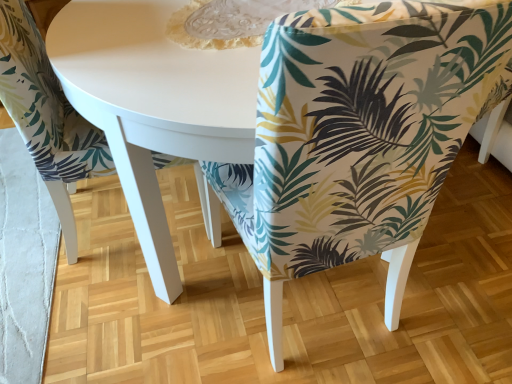
Describe the element at coordinates (362, 134) in the screenshot. This screenshot has height=384, width=512. I see `printed fabric chair at center, marked as the second chair in a left-to-right arrangement` at that location.

What is the approximate height of printed fabric chair at center, the 1th chair viewed from the right?

printed fabric chair at center, the 1th chair viewed from the right, is 38.58 inches tall.

Locate an element on the screen. The height and width of the screenshot is (384, 512). printed fabric chair at center, the 1th chair viewed from the right is located at coordinates (362, 134).

In order to click on printed fabric chair at center, which is counted as the 1th chair, starting from the left in this screenshot , I will do `click(47, 116)`.

This screenshot has width=512, height=384. Describe the element at coordinates (47, 116) in the screenshot. I see `printed fabric chair at center, the second chair positioned from the right` at that location.

Where is `printed fabric chair at center, marked as the second chair in a left-to-right arrangement`? printed fabric chair at center, marked as the second chair in a left-to-right arrangement is located at coordinates (362, 134).

Is printed fabric chair at center, the 1th chair viewed from the right, at the right side of printed fabric chair at center, which is counted as the 1th chair, starting from the left?

Correct, you'll find printed fabric chair at center, the 1th chair viewed from the right, to the right of printed fabric chair at center, which is counted as the 1th chair, starting from the left.

Based on the photo, is printed fabric chair at center, marked as the second chair in a left-to-right arrangement, in front of or behind printed fabric chair at center, which is counted as the 1th chair, starting from the left, in the image?

printed fabric chair at center, marked as the second chair in a left-to-right arrangement, is in front of printed fabric chair at center, which is counted as the 1th chair, starting from the left.

Is point (343, 171) behind point (73, 168)?

No, it is not.

From the image's perspective, is printed fabric chair at center, marked as the second chair in a left-to-right arrangement, on top of printed fabric chair at center, which is counted as the 1th chair, starting from the left?

No, from the image's perspective, printed fabric chair at center, marked as the second chair in a left-to-right arrangement, is not above printed fabric chair at center, which is counted as the 1th chair, starting from the left.

From a real-world perspective, is printed fabric chair at center, the 1th chair viewed from the right, located higher than printed fabric chair at center, the second chair positioned from the right?

Yes.

Which object is wider, printed fabric chair at center, the 1th chair viewed from the right, or printed fabric chair at center, which is counted as the 1th chair, starting from the left?

Wider between the two is printed fabric chair at center, which is counted as the 1th chair, starting from the left.

Which of these two, printed fabric chair at center, marked as the second chair in a left-to-right arrangement, or printed fabric chair at center, the second chair positioned from the right, stands taller?

printed fabric chair at center, marked as the second chair in a left-to-right arrangement, is taller.

Between printed fabric chair at center, the 1th chair viewed from the right, and printed fabric chair at center, the second chair positioned from the right, which one has smaller size?

With smaller size is printed fabric chair at center, the second chair positioned from the right.

Is printed fabric chair at center, the 1th chair viewed from the right, spatially inside printed fabric chair at center, which is counted as the 1th chair, starting from the left, or outside of it?

printed fabric chair at center, the 1th chair viewed from the right, is spatially situated outside printed fabric chair at center, which is counted as the 1th chair, starting from the left.

Is printed fabric chair at center, marked as the second chair in a left-to-right arrangement, far from printed fabric chair at center, the second chair positioned from the right?

printed fabric chair at center, marked as the second chair in a left-to-right arrangement, is near printed fabric chair at center, the second chair positioned from the right, not far away.

Is printed fabric chair at center, the second chair positioned from the right, at the back of printed fabric chair at center, marked as the second chair in a left-to-right arrangement?

No, printed fabric chair at center, marked as the second chair in a left-to-right arrangement,'s orientation is not away from printed fabric chair at center, the second chair positioned from the right.

What's the angular difference between printed fabric chair at center, the 1th chair viewed from the right, and printed fabric chair at center, the second chair positioned from the right,'s facing directions?

The facing directions of printed fabric chair at center, the 1th chair viewed from the right, and printed fabric chair at center, the second chair positioned from the right, are 89 degrees apart.

Identify the location of chair located on the left of printed fabric chair at center, marked as the second chair in a left-to-right arrangement. The height and width of the screenshot is (384, 512). (47, 116).

Which is more to the right, printed fabric chair at center, the second chair positioned from the right, or printed fabric chair at center, the 1th chair viewed from the right?

From the viewer's perspective, printed fabric chair at center, the 1th chair viewed from the right, appears more on the right side.

Between printed fabric chair at center, which is counted as the 1th chair, starting from the left, and printed fabric chair at center, the 1th chair viewed from the right, which one is positioned in front?

Positioned in front is printed fabric chair at center, the 1th chair viewed from the right.

Which is behind, point (83, 164) or point (455, 122)?

The point (83, 164) is farther.

From the image's perspective, would you say printed fabric chair at center, which is counted as the 1th chair, starting from the left, is shown under printed fabric chair at center, marked as the second chair in a left-to-right arrangement?

No, from the image's perspective, printed fabric chair at center, which is counted as the 1th chair, starting from the left, is not below printed fabric chair at center, marked as the second chair in a left-to-right arrangement.

From a real-world perspective, is printed fabric chair at center, which is counted as the 1th chair, starting from the left, below printed fabric chair at center, marked as the second chair in a left-to-right arrangement?

Yes, from a real-world perspective, printed fabric chair at center, which is counted as the 1th chair, starting from the left, is below printed fabric chair at center, marked as the second chair in a left-to-right arrangement.

Looking at their sizes, would you say printed fabric chair at center, which is counted as the 1th chair, starting from the left, is wider or thinner than printed fabric chair at center, marked as the second chair in a left-to-right arrangement?

In the image, printed fabric chair at center, which is counted as the 1th chair, starting from the left, appears to be wider than printed fabric chair at center, marked as the second chair in a left-to-right arrangement.

Considering the relative sizes of printed fabric chair at center, which is counted as the 1th chair, starting from the left, and printed fabric chair at center, marked as the second chair in a left-to-right arrangement, in the image provided, is printed fabric chair at center, which is counted as the 1th chair, starting from the left, taller than printed fabric chair at center, marked as the second chair in a left-to-right arrangement,?

No, printed fabric chair at center, which is counted as the 1th chair, starting from the left, is not taller than printed fabric chair at center, marked as the second chair in a left-to-right arrangement.

Considering the relative sizes of printed fabric chair at center, which is counted as the 1th chair, starting from the left, and printed fabric chair at center, marked as the second chair in a left-to-right arrangement, in the image provided, is printed fabric chair at center, which is counted as the 1th chair, starting from the left, smaller than printed fabric chair at center, marked as the second chair in a left-to-right arrangement,?

Yes.

Which is correct: printed fabric chair at center, which is counted as the 1th chair, starting from the left, is inside printed fabric chair at center, the 1th chair viewed from the right, or outside of it?

printed fabric chair at center, which is counted as the 1th chair, starting from the left, is spatially situated outside printed fabric chair at center, the 1th chair viewed from the right.

Is printed fabric chair at center, which is counted as the 1th chair, starting from the left, with printed fabric chair at center, marked as the second chair in a left-to-right arrangement?

No, printed fabric chair at center, which is counted as the 1th chair, starting from the left, is not with printed fabric chair at center, marked as the second chair in a left-to-right arrangement.

Is printed fabric chair at center, the second chair positioned from the right, positioned with its back to printed fabric chair at center, the 1th chair viewed from the right?

No, printed fabric chair at center, the second chair positioned from the right,'s orientation is not away from printed fabric chair at center, the 1th chair viewed from the right.

Identify the location of chair below the printed fabric chair at center, marked as the second chair in a left-to-right arrangement (from a real-world perspective). This screenshot has height=384, width=512. (47, 116).

Where is `chair on the right of printed fabric chair at center, which is counted as the 1th chair, starting from the left`? This screenshot has width=512, height=384. chair on the right of printed fabric chair at center, which is counted as the 1th chair, starting from the left is located at coordinates (362, 134).

Locate an element on the screen. The image size is (512, 384). chair that is under the printed fabric chair at center, the 1th chair viewed from the right (from a real-world perspective) is located at coordinates click(x=47, y=116).